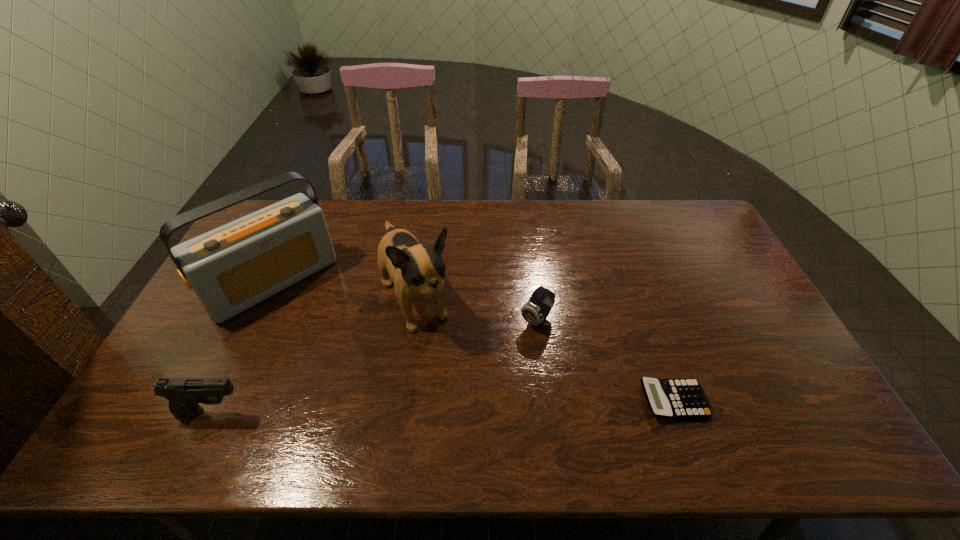
Image resolution: width=960 pixels, height=540 pixels. What are the coordinates of `unoccupied area between the pistol and the radio receiver` in the screenshot? It's located at pos(242,346).

This screenshot has width=960, height=540. Identify the location of unoccupied area between the puppy and the pistol. (312, 357).

Where is `vacant point located between the radio receiver and the pistol`? The height and width of the screenshot is (540, 960). vacant point located between the radio receiver and the pistol is located at coordinates (242, 346).

Where is `free spot between the pistol and the radio receiver`? The image size is (960, 540). free spot between the pistol and the radio receiver is located at coordinates (242, 346).

Locate an element on the screen. free space between the third object from right to left and the calculator is located at coordinates (543, 352).

The image size is (960, 540). What are the coordinates of `empty location between the shortest object and the puppy` in the screenshot? It's located at [543, 352].

Identify which object is located as the second nearest to the calculator. Please provide its 2D coordinates. Your answer should be formatted as a tuple, i.e. [(x, y)], where the tuple contains the x and y coordinates of a point satisfying the conditions above.

[(417, 270)]

This screenshot has width=960, height=540. I want to click on object that is the second closest one to the pistol, so click(x=417, y=270).

Find the location of `free space that satisfies the following two spatial constraints: 1. on the front side of the third object from left to right; 2. on the left side of the watch`. free space that satisfies the following two spatial constraints: 1. on the front side of the third object from left to right; 2. on the left side of the watch is located at coordinates (411, 321).